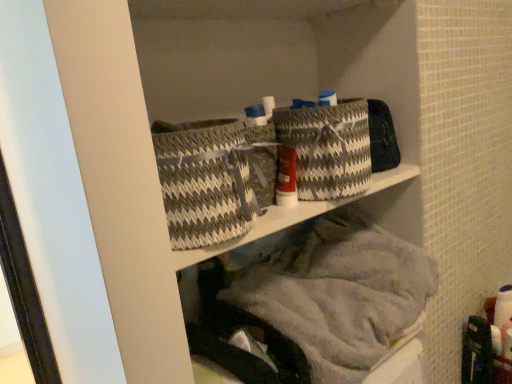
Question: From the image's perspective, does gray and white woven basket at center, which is the first basket from right to left, appear lower than gray woven basket at center, the first basket positioned from the left?

Choices:
 (A) no
 (B) yes

Answer: (A)

Question: Can you confirm if gray and white woven basket at center, which ranks as the second basket in left-to-right order, is positioned to the right of gray woven basket at center, the first basket positioned from the left?

Choices:
 (A) yes
 (B) no

Answer: (A)

Question: Is gray and white woven basket at center, which is the first basket from right to left, touching gray woven basket at center, the first basket positioned from the left?

Choices:
 (A) no
 (B) yes

Answer: (A)

Question: Is gray and white woven basket at center, which ranks as the second basket in left-to-right order, behind gray woven basket at center, the second basket positioned from the right?

Choices:
 (A) no
 (B) yes

Answer: (B)

Question: Is gray and white woven basket at center, which ranks as the second basket in left-to-right order, facing towards gray woven basket at center, the first basket positioned from the left?

Choices:
 (A) no
 (B) yes

Answer: (A)

Question: Does point (249, 215) appear closer or farther from the camera than point (307, 319)?

Choices:
 (A) closer
 (B) farther

Answer: (A)

Question: From their relative heights in the image, would you say gray woven basket at center, the second basket positioned from the right, is taller or shorter than gray woven baskets at upper center?

Choices:
 (A) tall
 (B) short

Answer: (B)

Question: From the image's perspective, relative to gray woven baskets at upper center, is gray woven basket at center, the second basket positioned from the right, above or below?

Choices:
 (A) below
 (B) above

Answer: (B)

Question: Which is correct: gray woven basket at center, the first basket positioned from the left, is inside gray woven baskets at upper center, or outside of it?

Choices:
 (A) outside
 (B) inside

Answer: (A)

Question: In terms of size, does gray woven basket at center, the second basket positioned from the right, appear bigger or smaller than gray and white woven basket at center, which is the first basket from right to left?

Choices:
 (A) big
 (B) small

Answer: (A)

Question: From a real-world perspective, relative to gray and white woven basket at center, which is the first basket from right to left, is gray woven basket at center, the first basket positioned from the left, vertically above or below?

Choices:
 (A) above
 (B) below

Answer: (B)

Question: Considering the positions of gray woven basket at center, the second basket positioned from the right, and gray and white woven basket at center, which is the first basket from right to left, in the image, is gray woven basket at center, the second basket positioned from the right, taller or shorter than gray and white woven basket at center, which is the first basket from right to left,?

Choices:
 (A) tall
 (B) short

Answer: (B)

Question: Which is correct: gray woven basket at center, the first basket positioned from the left, is inside gray and white woven basket at center, which is the first basket from right to left, or outside of it?

Choices:
 (A) outside
 (B) inside

Answer: (A)

Question: From the image's perspective, is gray and white woven basket at center, which is the first basket from right to left, positioned above or below gray woven baskets at upper center?

Choices:
 (A) below
 (B) above

Answer: (B)

Question: In terms of width, does gray and white woven basket at center, which is the first basket from right to left, look wider or thinner when compared to gray woven baskets at upper center?

Choices:
 (A) wide
 (B) thin

Answer: (B)